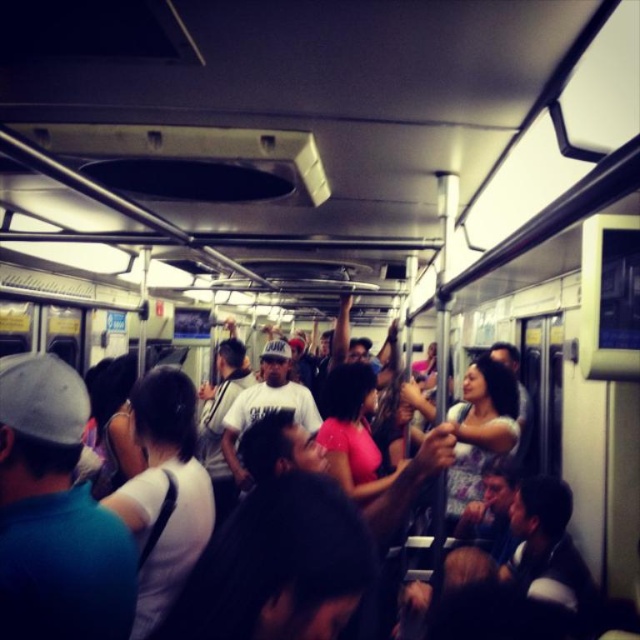
Does matte gray cap at left have a greater width compared to white matte shirt at center?

No, matte gray cap at left is not wider than white matte shirt at center.

Does point (44, 620) come closer to viewer compared to point (147, 541)?

That is True.

Find the location of a particular element. The width and height of the screenshot is (640, 640). matte gray cap at left is located at coordinates (54, 515).